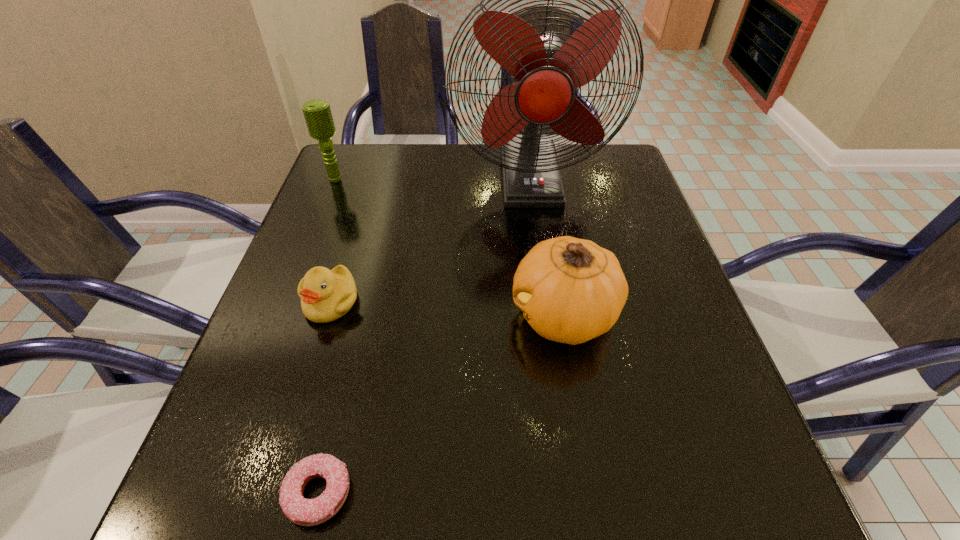
This screenshot has height=540, width=960. Identify the location of pumpkin that is at the right edge. (570, 290).

What are the coordinates of `object situated at the far left corner` in the screenshot? It's located at (317, 113).

Where is `object that is at the near left corner`? The image size is (960, 540). object that is at the near left corner is located at coordinates click(x=306, y=512).

Find the location of a particular element. The width and height of the screenshot is (960, 540). object present at the far right corner is located at coordinates (544, 73).

The height and width of the screenshot is (540, 960). I want to click on vacant space at the far edge of the desktop, so click(484, 190).

Where is `vacant space at the near edge of the desktop`? Image resolution: width=960 pixels, height=540 pixels. vacant space at the near edge of the desktop is located at coordinates (374, 488).

The width and height of the screenshot is (960, 540). In order to click on free region at the left edge of the desktop in this screenshot , I will do `click(363, 214)`.

Where is `vacant space at the right edge of the desktop`? The height and width of the screenshot is (540, 960). vacant space at the right edge of the desktop is located at coordinates (622, 362).

Identify the location of free space at the far left corner of the desktop. (345, 177).

Locate an element on the screen. This screenshot has height=540, width=960. free region at the near left corner is located at coordinates (224, 525).